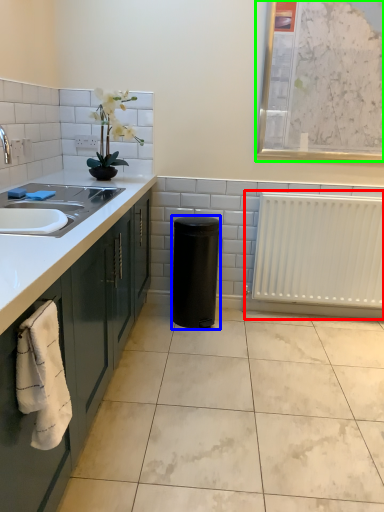
Question: Based on their relative distances, which object is nearer to radiator (highlighted by a red box)? Choose from appliance (highlighted by a blue box) and bulletin board (highlighted by a green box).

Choices:
 (A) appliance
 (B) bulletin board

Answer: (A)